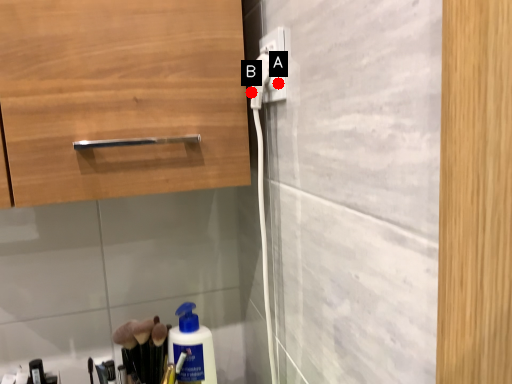
Question: Two points are circled on the image, labeled by A and B beside each circle. Which point is closer to the camera?

Choices:
 (A) A is closer
 (B) B is closer

Answer: (A)